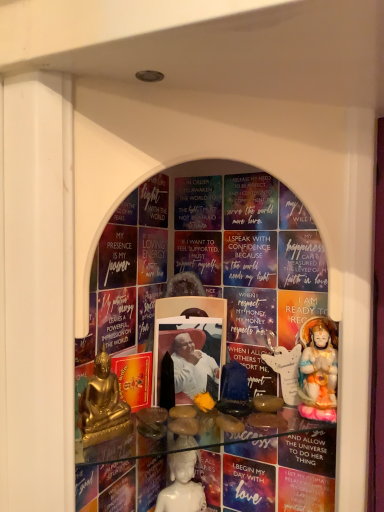
Question: Can you confirm if porcelain statue at right, which is counted as the 2th person, starting from the front, is positioned to the right of gold metallic statue at lower left, the 1th person from the left?

Choices:
 (A) yes
 (B) no

Answer: (A)

Question: From the image's perspective, is porcelain statue at right, positioned as the 3th person in bottom-to-top order, on top of gold metallic statue at lower left, which is the third person from right to left?

Choices:
 (A) no
 (B) yes

Answer: (B)

Question: Is porcelain statue at right, the 1th person in the top-to-bottom sequence, oriented towards gold metallic statue at lower left, which is counted as the third person, starting from the back?

Choices:
 (A) yes
 (B) no

Answer: (B)

Question: Is porcelain statue at right, the 1th person in the top-to-bottom sequence, far away from gold metallic statue at lower left, placed as the first person when sorted from front to back?

Choices:
 (A) no
 (B) yes

Answer: (A)

Question: Considering the relative sizes of porcelain statue at right, the 1th person in the top-to-bottom sequence, and gold metallic statue at lower left, which is counted as the third person, starting from the back, in the image provided, is porcelain statue at right, the 1th person in the top-to-bottom sequence, wider than gold metallic statue at lower left, which is counted as the third person, starting from the back,?

Choices:
 (A) yes
 (B) no

Answer: (A)

Question: Does porcelain statue at right, which appears as the 3th person when viewed from the left, touch gold metallic statue at lower left, which is the third person from right to left?

Choices:
 (A) yes
 (B) no

Answer: (B)

Question: Is the surface of white porcelain statue at center, which is the second person from left to right, in direct contact with porcelain statue at right, which appears as the 3th person when viewed from the left?

Choices:
 (A) no
 (B) yes

Answer: (A)

Question: Can you confirm if white porcelain statue at center, the second person in the right-to-left sequence, is smaller than porcelain statue at right, positioned as the 3th person in bottom-to-top order?

Choices:
 (A) no
 (B) yes

Answer: (B)

Question: Is white porcelain statue at center, which is the second person from left to right, positioned with its back to porcelain statue at right, which is counted as the 2th person, starting from the front?

Choices:
 (A) yes
 (B) no

Answer: (B)

Question: Is white porcelain statue at center, the 3th person when ordered from front to back, positioned before porcelain statue at right, positioned as the 3th person in bottom-to-top order?

Choices:
 (A) no
 (B) yes

Answer: (A)

Question: Does white porcelain statue at center, which is the second person from left to right, have a greater height compared to porcelain statue at right, which is counted as the 2th person, starting from the front?

Choices:
 (A) yes
 (B) no

Answer: (B)

Question: Is white porcelain statue at center, marked as the first person in a back-to-front arrangement, completely or partially outside of porcelain statue at right, the second person viewed from the back?

Choices:
 (A) yes
 (B) no

Answer: (A)

Question: Is porcelain statue at right, which is counted as the 2th person, starting from the front, looking in the opposite direction of white porcelain statue at center, marked as the first person in a back-to-front arrangement?

Choices:
 (A) no
 (B) yes

Answer: (A)